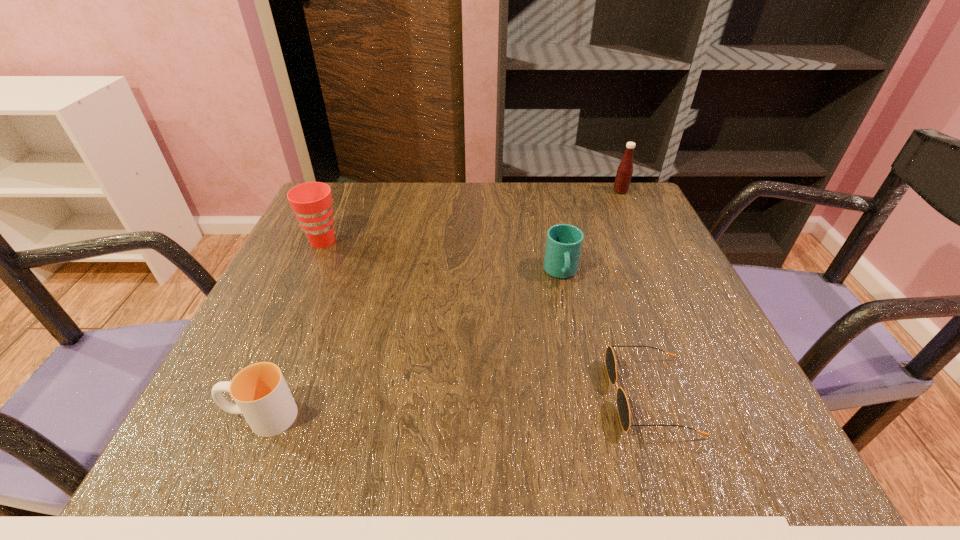
At what (x,y) coordinates should I click in order to perform the action: click on vacant position located 0.260m on the handle side of the third farthest object. Please return your answer as a coordinate pair (x, y). Image resolution: width=960 pixels, height=540 pixels. Looking at the image, I should click on (588, 400).

Where is `vacant space located 0.050m with the handle on the side of the nearest cup`? This screenshot has height=540, width=960. vacant space located 0.050m with the handle on the side of the nearest cup is located at coordinates (195, 416).

The image size is (960, 540). I want to click on vacant space situated on the front-facing side of the shortest object, so click(x=528, y=396).

Identify the location of vacant region located on the front-facing side of the shortest object. The image size is (960, 540). [x=521, y=396].

The image size is (960, 540). In order to click on vacant space located on the front-facing side of the shortest object in this screenshot , I will do `click(535, 396)`.

Identify the location of Tabasco sauce that is at the far edge. point(624,172).

Identify the location of cup that is positioned at the far edge. This screenshot has width=960, height=540. (311, 202).

Locate an element on the screen. Image resolution: width=960 pixels, height=540 pixels. cup that is at the near edge is located at coordinates (261, 394).

Locate an element on the screen. sunglasses that is positioned at the near edge is located at coordinates (623, 408).

Locate an element on the screen. This screenshot has width=960, height=540. Tabasco sauce present at the right edge is located at coordinates (624, 172).